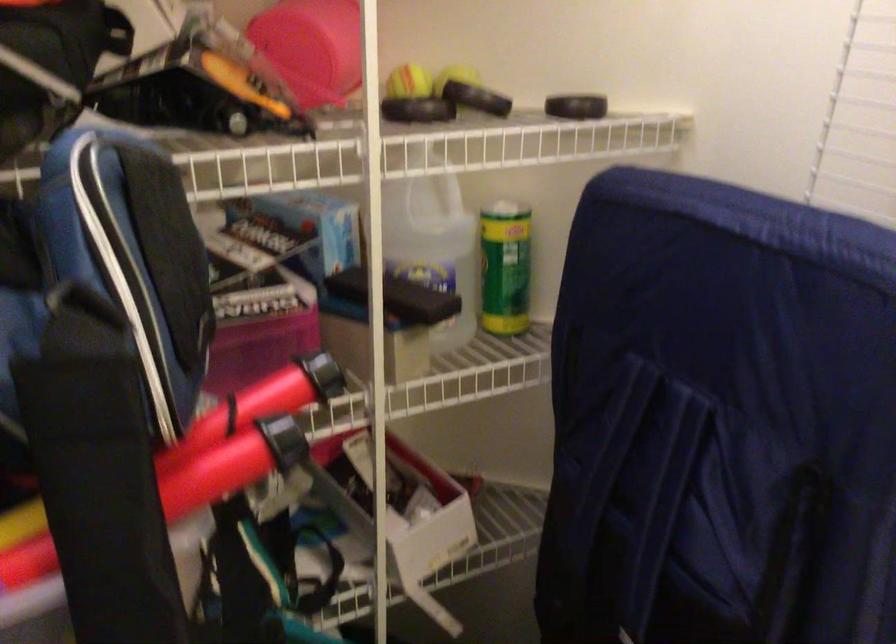
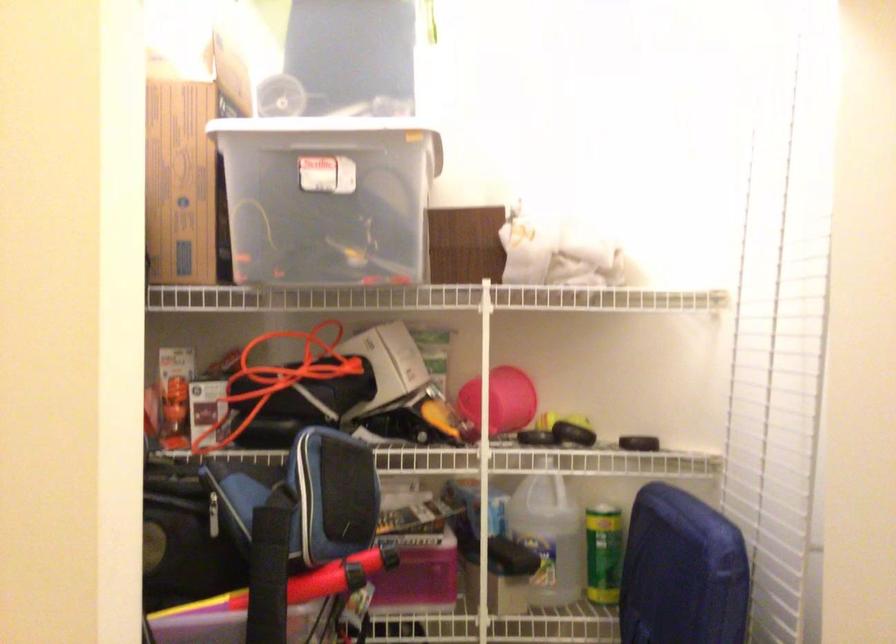
Where in the second image is the point corresponding to [515,269] from the first image?

(604, 554)